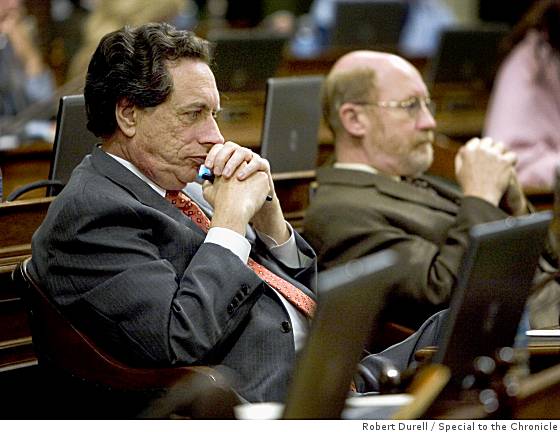
The width and height of the screenshot is (560, 432). I want to click on monitor, so click(73, 145), click(277, 125), click(489, 277), click(345, 325), click(236, 60), click(475, 45).